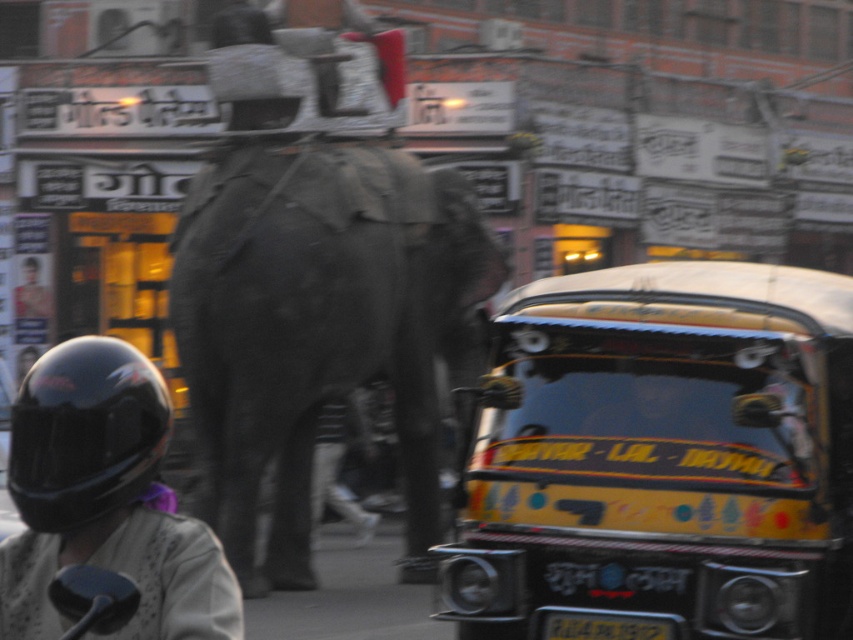
Question: Based on their relative distances, which object is farther from the black matte helmet at lower left?

Choices:
 (A) gray textured elephant at center
 (B) yellow painted auto-rickshaw at center
 (C) black plastic license plate at center

Answer: (A)

Question: Which point is farther to the camera?

Choices:
 (A) yellow painted auto-rickshaw at center
 (B) black matte helmet at lower left

Answer: (A)

Question: Where is yellow painted auto-rickshaw at center located in relation to black matte helmet at lower left in the image?

Choices:
 (A) right
 (B) left

Answer: (A)

Question: Is yellow painted auto-rickshaw at center further to camera compared to black matte helmet at lower left?

Choices:
 (A) yes
 (B) no

Answer: (A)

Question: Which of these objects is positioned closest to the gray textured elephant at center?

Choices:
 (A) yellow painted auto-rickshaw at center
 (B) black plastic license plate at center

Answer: (A)

Question: Observing the image, what is the correct spatial positioning of black matte helmet at lower left in reference to black plastic license plate at center?

Choices:
 (A) left
 (B) right

Answer: (A)